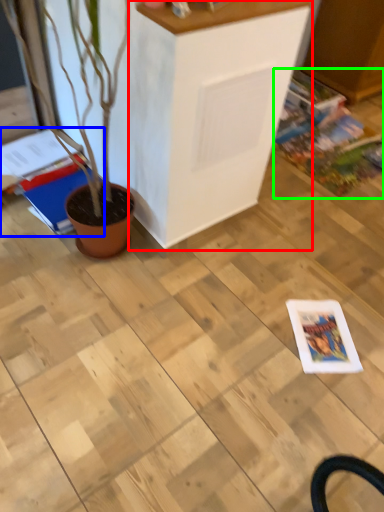
Question: Considering the real-world distances, which object is farthest from furniture (highlighted by a red box)? magazine (highlighted by a blue box) or comic book (highlighted by a green box)?

Choices:
 (A) magazine
 (B) comic book

Answer: (B)